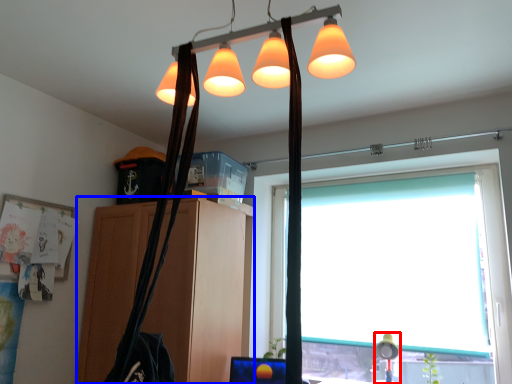
Question: Which of the following is the closest to the observer, table lamp (highlighted by a red box) or cabinetry (highlighted by a blue box)?

Choices:
 (A) table lamp
 (B) cabinetry

Answer: (B)